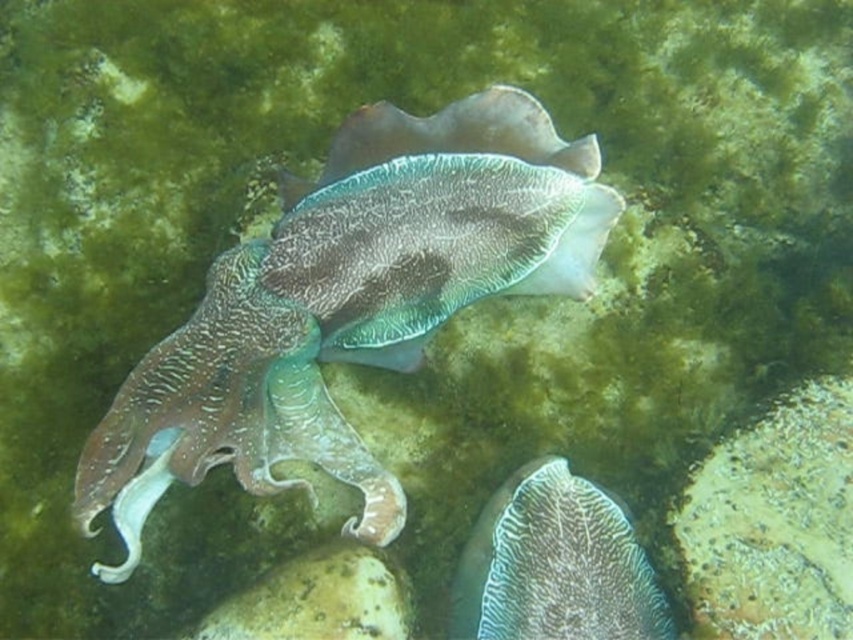
Is point (509, 109) positioned after point (451, 612)?

Yes, point (509, 109) is behind point (451, 612).

Between point (76, 488) and point (531, 500), which one is positioned behind?

The point (531, 500) is behind.

Locate an element on the screen. The width and height of the screenshot is (853, 640). textured brown squid at center is located at coordinates (347, 301).